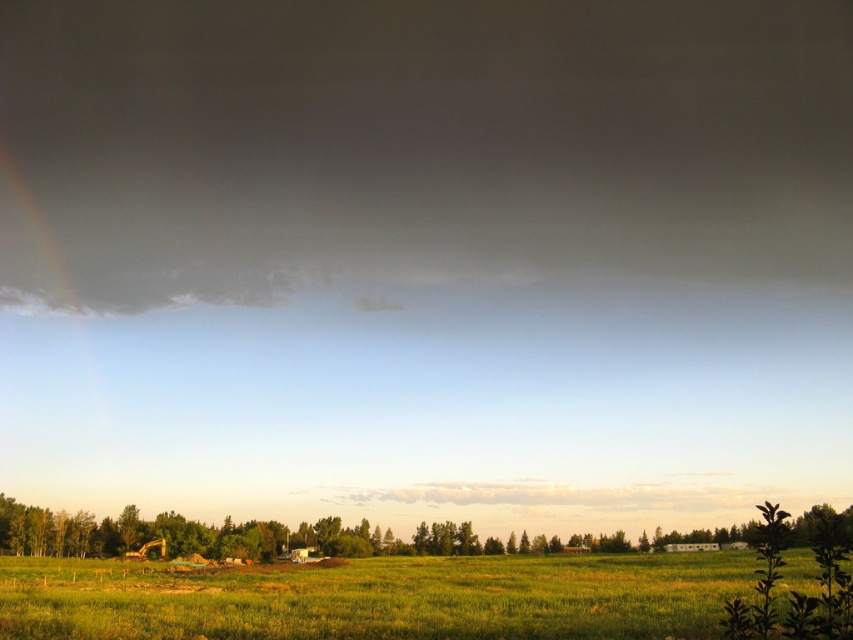
Looking at this image, can you confirm if dark gray cloud at upper center is positioned to the left of green leafy tree at lower left?

In fact, dark gray cloud at upper center is to the right of green leafy tree at lower left.

In the scene shown: Does dark gray cloud at upper center have a greater width compared to green leafy tree at lower left?

Indeed, dark gray cloud at upper center has a greater width compared to green leafy tree at lower left.

This screenshot has width=853, height=640. In order to click on dark gray cloud at upper center in this screenshot , I will do `click(416, 145)`.

Identify the location of dark gray cloud at upper center. This screenshot has width=853, height=640. (416, 145).

Can you confirm if green grassy field at lower center is bigger than green leafy tree at lower left?

No, green grassy field at lower center is not bigger than green leafy tree at lower left.

Between point (474, 595) and point (154, 518), which one is positioned in front?

Point (474, 595) is in front.

Identify the location of green grassy field at lower center. This screenshot has height=640, width=853. (378, 598).

Does dark gray cloud at upper center appear under green grassy field at lower center?

No, dark gray cloud at upper center is not below green grassy field at lower center.

Does point (343, 125) lie behind point (682, 576)?

Yes, point (343, 125) is behind point (682, 576).

This screenshot has width=853, height=640. I want to click on dark gray cloud at upper center, so click(x=416, y=145).